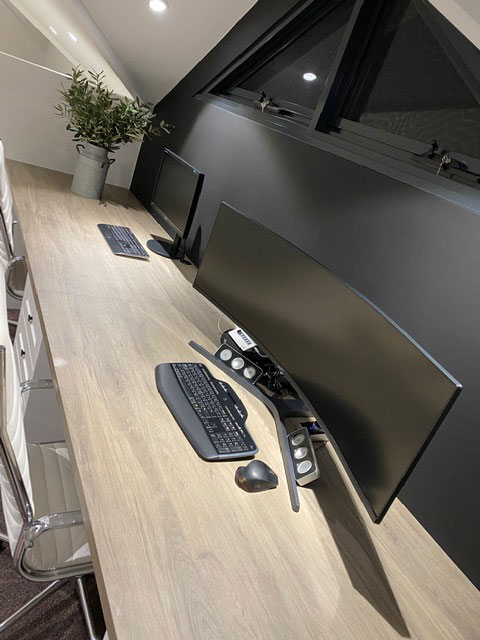
Where is `dark gray carpet`? The height and width of the screenshot is (640, 480). dark gray carpet is located at coordinates (47, 623), (14, 589).